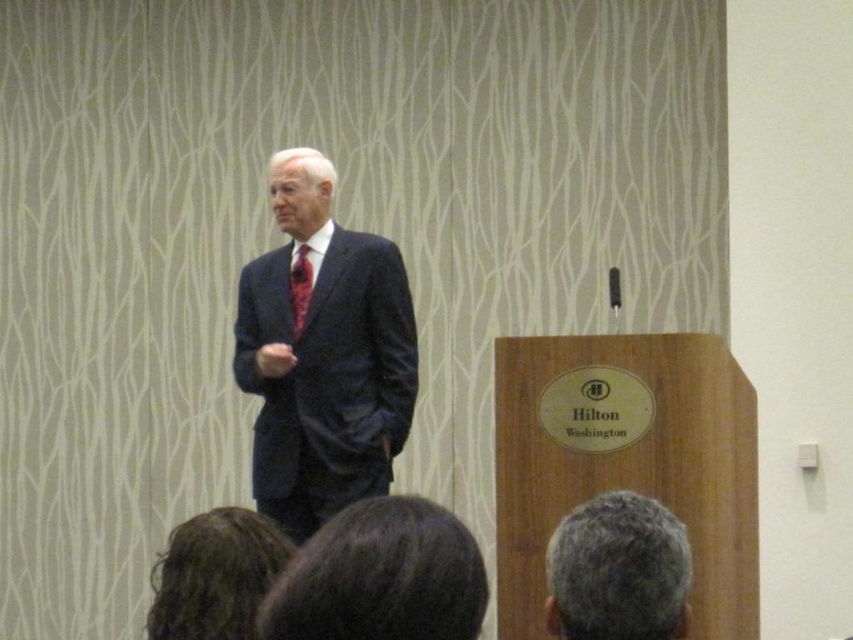
What is the 2D coordinate of the gray hair at lower center in the image?

The gray hair at lower center is located at the 2D coordinate point of (618, 570).

You are a photographer positioned to capture the speaker at the podium. The dark brown hair at lower center is part of the speaker. To ensure the hair is in focus, where should you aim the camera? Please specify the coordinates provided in the description.

The dark brown hair at lower center is located at point [381,577], so aim the camera at those coordinates to ensure it is in focus.